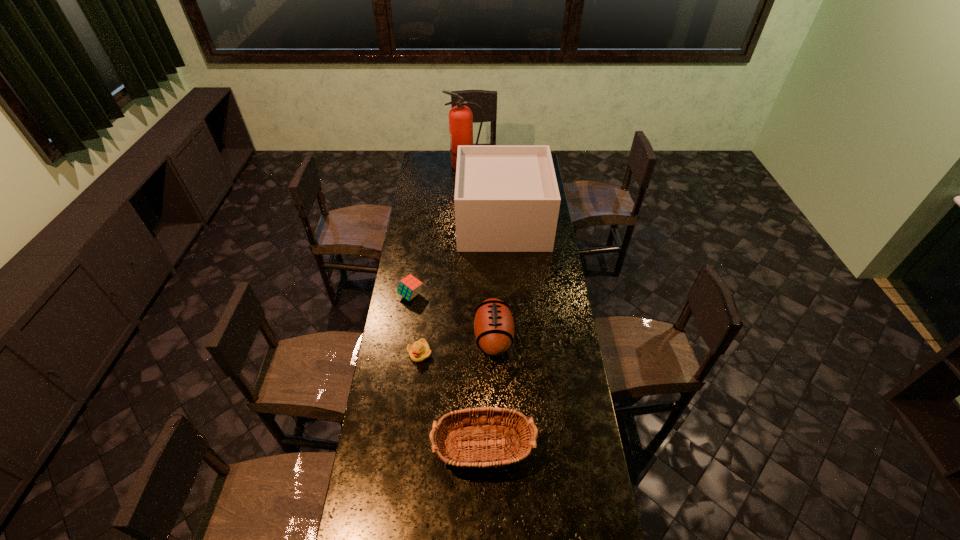
The height and width of the screenshot is (540, 960). In order to click on free location located on the side of the second tallest object with the window in this screenshot , I will do `click(445, 221)`.

At what (x,y) coordinates should I click in order to perform the action: click on free point located 0.130m on the side of the second tallest object with the window. Please return your answer as a coordinate pair (x, y). Looking at the image, I should click on (435, 221).

The width and height of the screenshot is (960, 540). I want to click on free location located 0.160m on the side of the second tallest object with the window, so click(x=429, y=221).

Where is `blank space located on the back of the basket`? This screenshot has width=960, height=540. blank space located on the back of the basket is located at coordinates (482, 335).

Where is `free space located 0.260m on the back of the football (American)`? The width and height of the screenshot is (960, 540). free space located 0.260m on the back of the football (American) is located at coordinates (492, 270).

This screenshot has height=540, width=960. What are the coordinates of `free space located 0.190m on the front of the fourth nearest object` in the screenshot? It's located at (405, 339).

The height and width of the screenshot is (540, 960). I want to click on vacant area situated 0.080m at the face of the duckling, so click(417, 381).

Find the location of a particular element. The image size is (960, 540). object at the far edge is located at coordinates (460, 117).

What are the coordinates of `cube that is positioned at the left edge` in the screenshot? It's located at (409, 287).

At what (x,y) coordinates should I click in order to perform the action: click on duckling that is positioned at the left edge. Please return your answer as a coordinate pair (x, y). The height and width of the screenshot is (540, 960). Looking at the image, I should click on (419, 351).